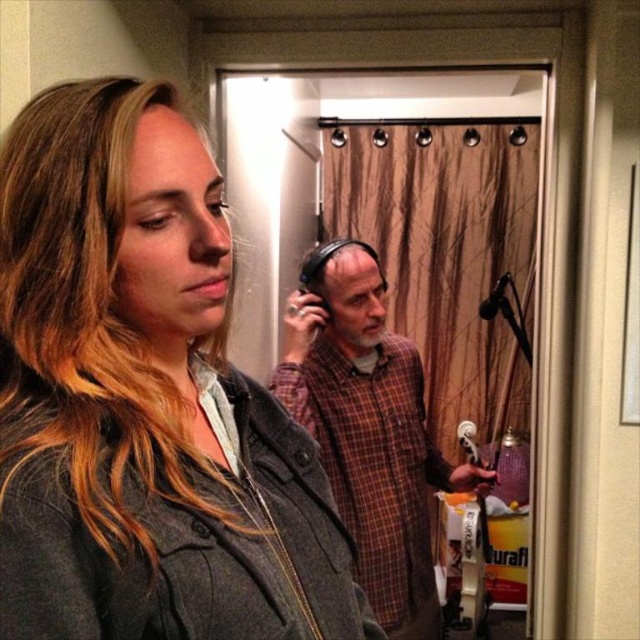
Is matte gray jacket at center positioned before plaid fabric shirt at center?

Yes.

Which is behind, point (116, 292) or point (394, 342)?

Positioned behind is point (394, 342).

Find the location of a particular element. matte gray jacket at center is located at coordinates (144, 397).